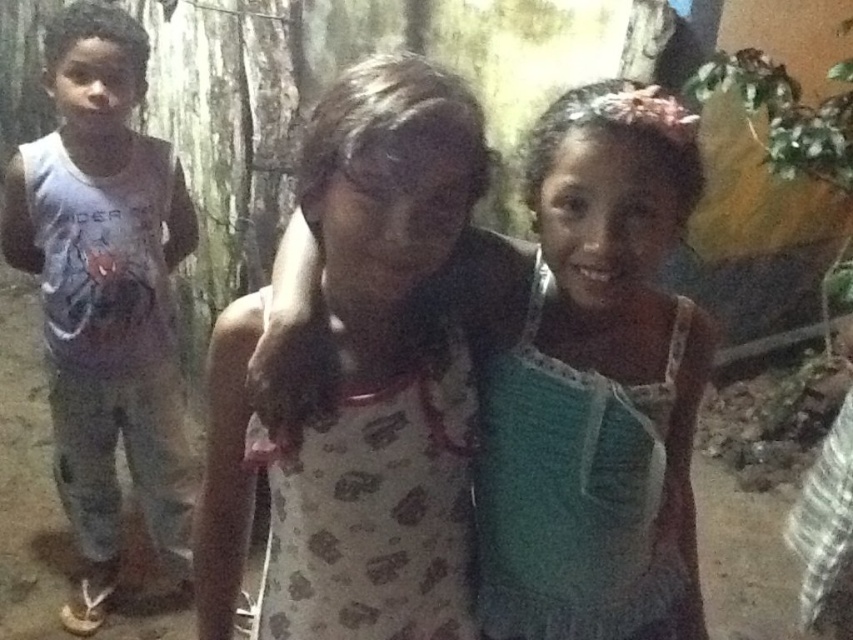
Is point (369, 129) farther from viewer compared to point (0, 227)?

That is False.

Is point (316, 170) closer to viewer compared to point (143, 70)?

Yes, it is in front of point (143, 70).

This screenshot has height=640, width=853. What are the coordinates of `brown printed dress at center` in the screenshot? It's located at tap(380, 365).

Who is higher up, printed fabric dress at center or brown printed dress at center?

printed fabric dress at center is higher up.

Does point (560, 296) come closer to viewer compared to point (405, 252)?

No, (560, 296) is behind (405, 252).

Does point (575, 129) come closer to viewer compared to point (386, 429)?

Yes.

The height and width of the screenshot is (640, 853). Find the location of `printed fabric dress at center`. printed fabric dress at center is located at coordinates (592, 381).

Can you confirm if printed fabric dress at center is positioned below matte gray tank top at left?

Correct, printed fabric dress at center is located below matte gray tank top at left.

Is printed fabric dress at center smaller than matte gray tank top at left?

Correct, printed fabric dress at center occupies less space than matte gray tank top at left.

The image size is (853, 640). I want to click on printed fabric dress at center, so click(592, 381).

Where is `printed fabric dress at center`? The image size is (853, 640). printed fabric dress at center is located at coordinates (592, 381).